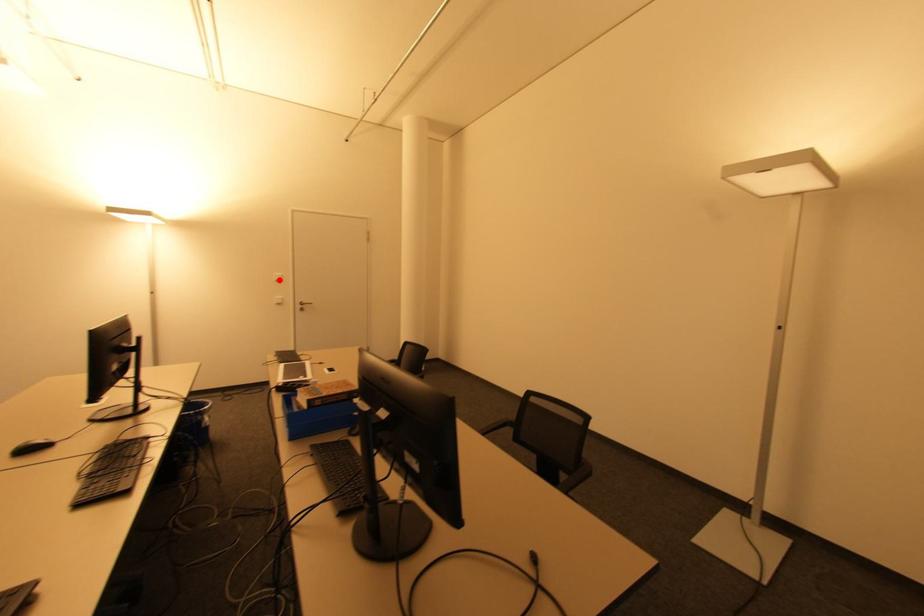
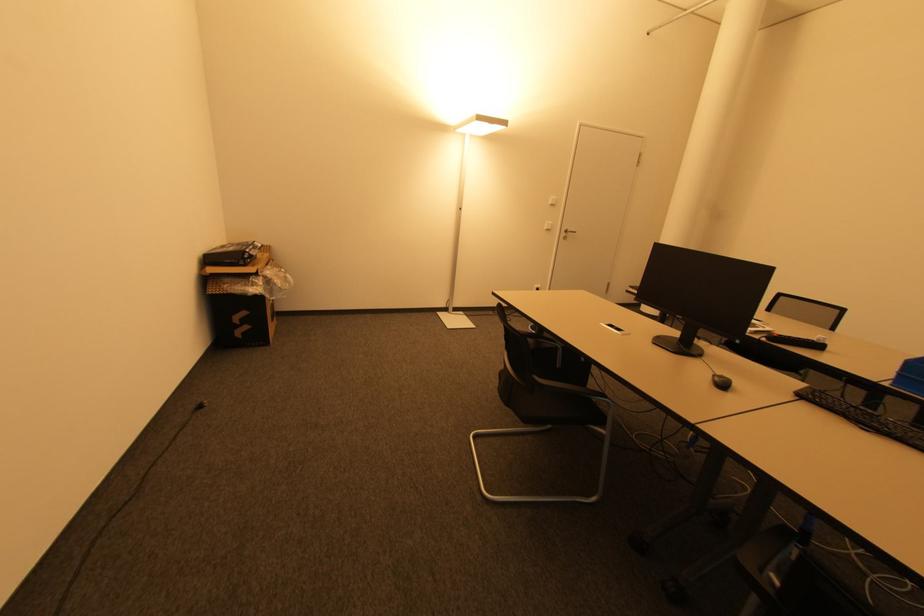
Locate, in the second image, the point that corresponds to the highlighted location in the first image.

(554, 204)